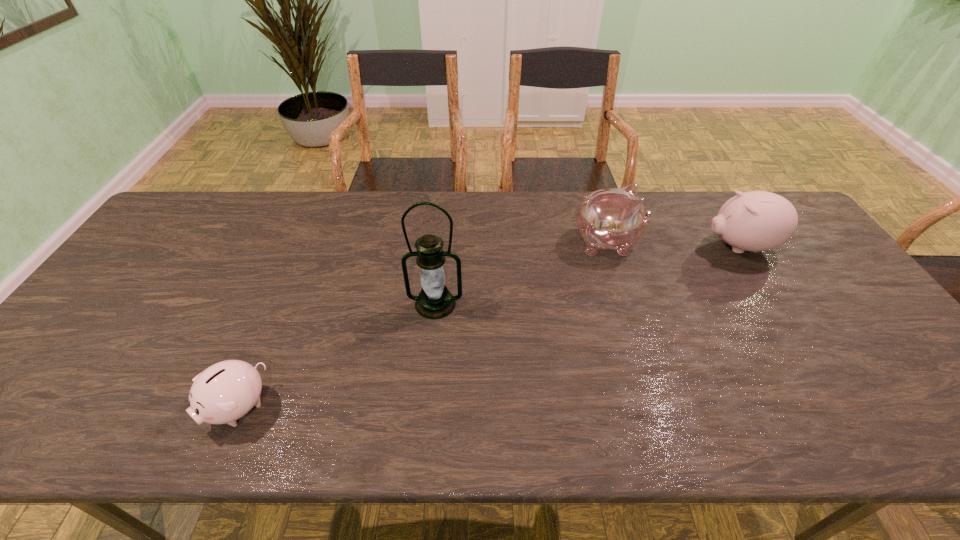
Image resolution: width=960 pixels, height=540 pixels. Find the location of `the second object from left to right`. the second object from left to right is located at coordinates (435, 301).

Identify the location of lantern. The image size is (960, 540). (435, 301).

I want to click on the third object from left to right, so click(614, 218).

Find the location of a particular element. The image size is (960, 540). the rightmost object is located at coordinates (755, 221).

You are a GUI agent. You are given a task and a screenshot of the screen. Output one action in this format:
    pyautogui.click(x=<x>, y=<y>)
    Task: Click on the leftmost piggy bank
    This screenshot has height=540, width=960.
    Given the screenshot: What is the action you would take?
    pyautogui.click(x=226, y=391)

In order to click on the shortest object in this screenshot , I will do `click(226, 391)`.

Locate an element on the screen. The width and height of the screenshot is (960, 540). free space located on the side where the third farthest object emits light is located at coordinates (427, 392).

Identify the location of vacant position located 0.250m on the front facing side of the second object from right to left. Image resolution: width=960 pixels, height=540 pixels. (723, 242).

Find the location of `free space located at the snout of the rightmost object`. free space located at the snout of the rightmost object is located at coordinates (594, 246).

Locate an element on the screen. free spot located at the snout of the rightmost object is located at coordinates (680, 246).